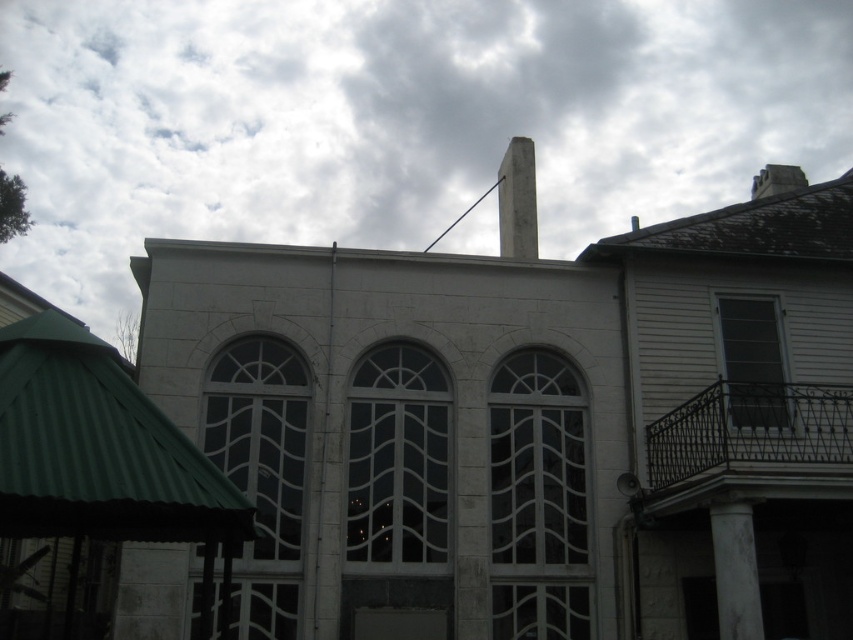
Who is lower down, white cloudy sky at upper center or green corrugated metal canopy at lower left?

Positioned lower is green corrugated metal canopy at lower left.

Between white cloudy sky at upper center and green corrugated metal canopy at lower left, which one appears on the left side from the viewer's perspective?

From the viewer's perspective, green corrugated metal canopy at lower left appears more on the left side.

Which is behind, point (373, 13) or point (184, 474)?

The point (373, 13) is more distant.

Identify the location of white cloudy sky at upper center. (x=393, y=120).

Is point (105, 435) positioned before point (730, 518)?

Yes, it is in front of point (730, 518).

Does green corrugated metal canopy at lower left come behind white stone column at lower right?

No.

Between point (4, 472) and point (740, 579), which one is positioned behind?

Positioned behind is point (740, 579).

Image resolution: width=853 pixels, height=640 pixels. In order to click on green corrugated metal canopy at lower left in this screenshot , I will do `click(97, 449)`.

Can you confirm if white cloudy sky at upper center is bigger than white stone column at lower right?

Indeed, white cloudy sky at upper center has a larger size compared to white stone column at lower right.

Is white cloudy sky at upper center shorter than white stone column at lower right?

Incorrect, white cloudy sky at upper center's height does not fall short of white stone column at lower right's.

Who is more distant from viewer, (209, 17) or (744, 508)?

Positioned behind is point (209, 17).

Find the location of `white cloudy sky at upper center`. white cloudy sky at upper center is located at coordinates (393, 120).